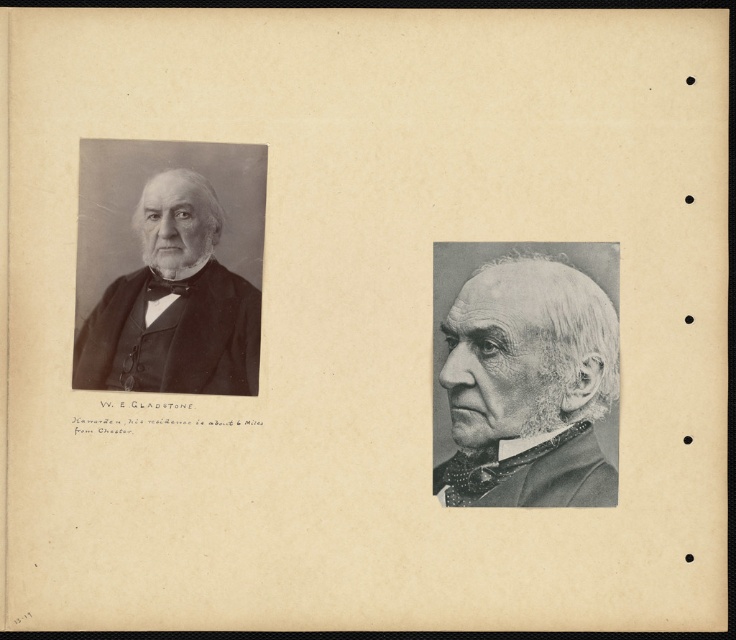
Who is more distant from viewer, (461,394) or (177,381)?

The point (177,381) is more distant.

Is gray matte suit at center smaller than matte black bow tie at left?

No.

Image resolution: width=736 pixels, height=640 pixels. What do you see at coordinates (528, 387) in the screenshot?
I see `gray matte suit at center` at bounding box center [528, 387].

Identify the location of gray matte suit at center. This screenshot has width=736, height=640. (528, 387).